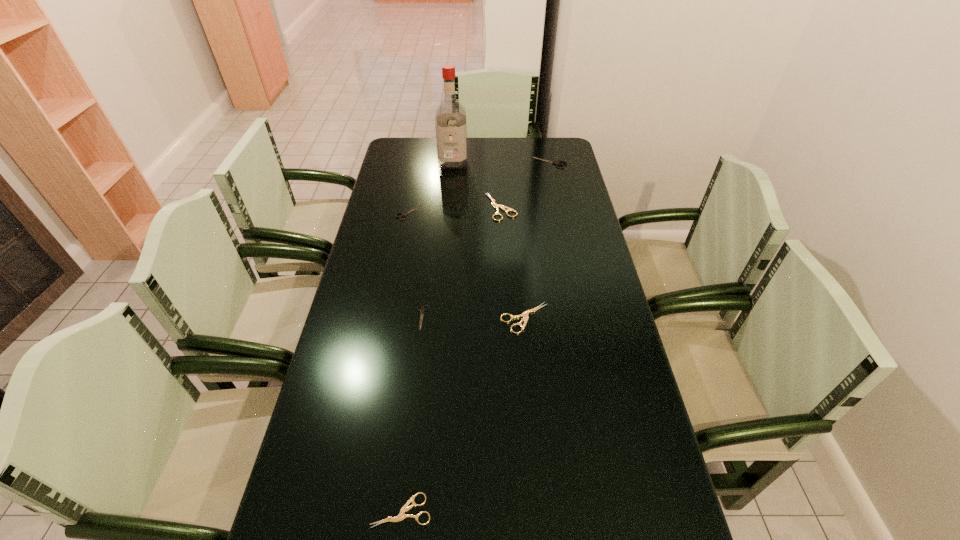
Locate an element on the screen. The height and width of the screenshot is (540, 960). vacant region between the biggest beige shears and the smallest black shears is located at coordinates (462, 262).

Where is `free spot between the second farthest beige shears and the nearest beige shears`? free spot between the second farthest beige shears and the nearest beige shears is located at coordinates (463, 414).

Locate an element on the screen. The width and height of the screenshot is (960, 540). free space that is in between the second farthest beige shears and the nearest black shears is located at coordinates (473, 318).

Image resolution: width=960 pixels, height=540 pixels. I want to click on unoccupied area between the tallest object and the leftmost black shears, so click(431, 187).

At what (x,y) coordinates should I click in order to perform the action: click on free space between the nearest black shears and the second nearest black shears. Please return your answer as a coordinate pair (x, y). Looking at the image, I should click on (416, 265).

Identify the location of vacant region between the leftmost beige shears and the second black shears from left to right. (412, 414).

What are the coordinates of `free spot between the leftmost black shears and the biggest beige shears` in the screenshot? It's located at (455, 210).

This screenshot has width=960, height=540. Find the location of `object that is the third closest one to the biggest beige shears`. object that is the third closest one to the biggest beige shears is located at coordinates (406, 213).

Select which object appears as the second closest to the nearest shears. Please provide its 2D coordinates. Your answer should be formatted as a tuple, i.e. [(x, y)], where the tuple contains the x and y coordinates of a point satisfying the conditions above.

[(525, 314)]

Identify the location of shears that is the closest to the second farthest beige shears. This screenshot has width=960, height=540. (422, 310).